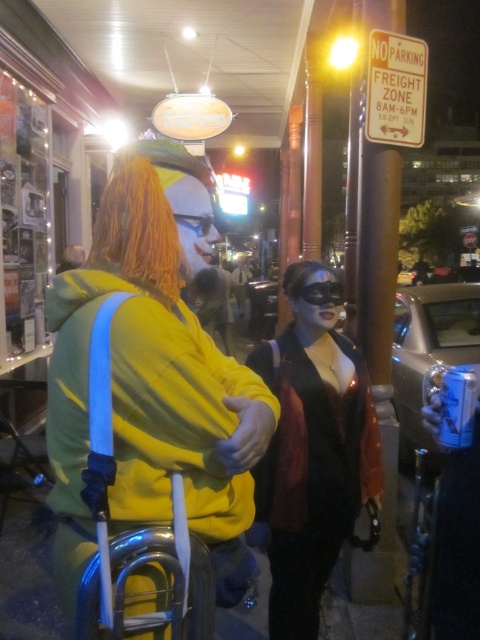
You are a photographer standing in the scene. You want to take a closeup photo of the clown and the leather jacket at center. Given that your camera has a maximum focus range of 5 feet, will both subjects be in focus?

The leather jacket at center is 5.01 feet away from viewer, which is slightly beyond the camera maximum focus range of 5 feet. Therefore, the clown is within focus, but the leather jacket at center will be out of focus.

You are a fashion designer observing the urban street scene. You notice two central items of clothing, the yellow matte hoodie at center and the leather jacket at center. Which clothing item is wider?

The yellow matte hoodie at center is wider than the leather jacket at center according to the description provided.

You are a photographer trying to capture the vibrant colors of the yellow matte hoodie at center and the orange synthetic wig at center in the night scene. Which object should you focus on first to ensure it appears in the foreground of your photo?

The yellow matte hoodie at center is below the orange synthetic wig at center, so focusing on the orange synthetic wig at center first would place it in the foreground since it is higher up in the frame.